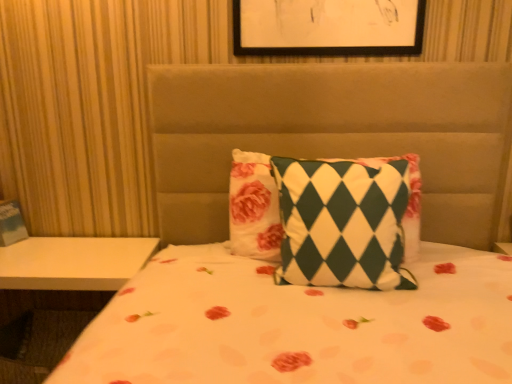
Question: Does green and white checkered pillow at center have a greater height compared to white glossy table at lower left?

Choices:
 (A) no
 (B) yes

Answer: (A)

Question: Is green and white checkered pillow at center further to camera compared to white glossy table at lower left?

Choices:
 (A) yes
 (B) no

Answer: (B)

Question: Is white glossy table at lower left at the back of green and white checkered pillow at center?

Choices:
 (A) yes
 (B) no

Answer: (B)

Question: From a real-world perspective, is green and white checkered pillow at center over white glossy table at lower left?

Choices:
 (A) no
 (B) yes

Answer: (B)

Question: Does green and white checkered pillow at center appear on the right side of white glossy table at lower left?

Choices:
 (A) no
 (B) yes

Answer: (B)

Question: Is green and white checkered pillow at center aimed at white glossy table at lower left?

Choices:
 (A) yes
 (B) no

Answer: (B)

Question: Is white glossy table at lower left positioned beyond the bounds of green and white checkered pillow at center?

Choices:
 (A) yes
 (B) no

Answer: (A)

Question: From the image's perspective, does white glossy table at lower left appear higher than green and white checkered pillow at center?

Choices:
 (A) yes
 (B) no

Answer: (B)

Question: Does white glossy table at lower left turn towards green and white checkered pillow at center?

Choices:
 (A) no
 (B) yes

Answer: (A)

Question: Is green and white checkered pillow at center located within white glossy table at lower left?

Choices:
 (A) yes
 (B) no

Answer: (B)

Question: Does white glossy table at lower left have a lesser width compared to green and white checkered pillow at center?

Choices:
 (A) yes
 (B) no

Answer: (B)

Question: Can you confirm if white glossy table at lower left is wider than green and white checkered pillow at center?

Choices:
 (A) yes
 (B) no

Answer: (A)

Question: From a real-world perspective, is white glossy table at lower left above or below green and white checkered pillow at center?

Choices:
 (A) above
 (B) below

Answer: (B)